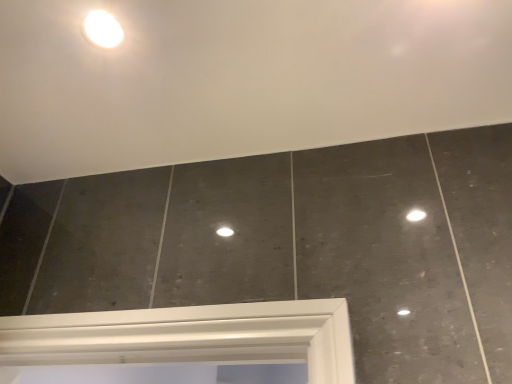
This screenshot has height=384, width=512. What do you see at coordinates (103, 29) in the screenshot? I see `white glossy light fixture at upper left` at bounding box center [103, 29].

Measure the distance between point (120,37) and camera.

A distance of 29.76 inches exists between point (120,37) and camera.

Where is `white glossy light fixture at upper left`? This screenshot has width=512, height=384. white glossy light fixture at upper left is located at coordinates (103, 29).

Where is `white glossy light fixture at upper left`? white glossy light fixture at upper left is located at coordinates (103, 29).